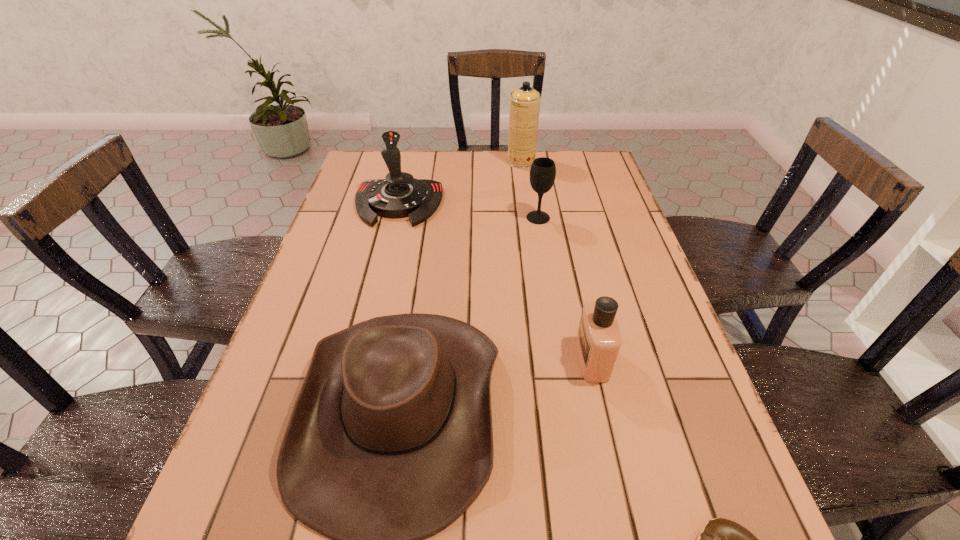
Identify the location of free space located on the front label of the perfume. The height and width of the screenshot is (540, 960). (452, 359).

The width and height of the screenshot is (960, 540). I want to click on aerosol can situated at the far edge, so click(x=525, y=101).

The image size is (960, 540). Find the location of `joystick present at the far edge`. joystick present at the far edge is located at coordinates (399, 195).

The height and width of the screenshot is (540, 960). I want to click on object present at the left edge, so click(399, 195).

Locate an element on the screen. This screenshot has width=960, height=540. object present at the far left corner is located at coordinates (399, 195).

Image resolution: width=960 pixels, height=540 pixels. Identify the location of free space at the far edge of the desktop. tap(424, 174).

What are the coordinates of `vacant space at the right edge of the desktop` in the screenshot? It's located at (677, 482).

Find the location of `vacant region at the far left corner of the desktop`. vacant region at the far left corner of the desktop is located at coordinates (385, 176).

Image resolution: width=960 pixels, height=540 pixels. Find the location of `vacant space at the far right corner`. vacant space at the far right corner is located at coordinates (573, 158).

The image size is (960, 540). I want to click on empty location between the wineglass and the fifth shortest object, so click(x=468, y=211).